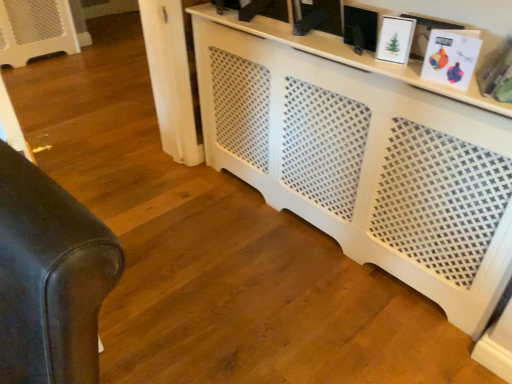
Question: Relative to white perforated cabinet at center, is matte black picture frame at upper center, which appears as the third picture frame when viewed from the right, in front or behind?

Choices:
 (A) front
 (B) behind

Answer: (B)

Question: Considering the positions of matte black picture frame at upper center, which is the 1th picture frame in left-to-right order, and white perforated cabinet at center in the image, is matte black picture frame at upper center, which is the 1th picture frame in left-to-right order, bigger or smaller than white perforated cabinet at center?

Choices:
 (A) big
 (B) small

Answer: (B)

Question: Which is farther from the white glossy picture frame at upper right, the 2th picture frame positioned from the right?

Choices:
 (A) white matte picture frame at upper right, the third picture frame from the left
 (B) leather couch at left
 (C) matte black picture frame at upper center, which appears as the third picture frame when viewed from the right
 (D) white perforated cabinet at center

Answer: (B)

Question: Considering the real-world distances, which object is farthest from the matte black picture frame at upper center, which appears as the third picture frame when viewed from the right?

Choices:
 (A) white perforated cabinet at center
 (B) leather couch at left
 (C) white glossy picture frame at upper right, the 2th picture frame positioned from the right
 (D) white matte picture frame at upper right, the third picture frame from the left

Answer: (B)